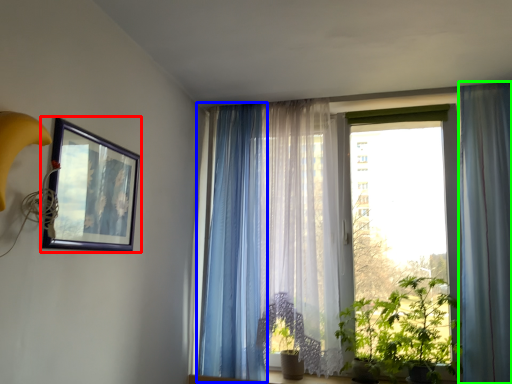
Question: Based on their relative distances, which object is farther from picture frame (highlighted by a red box)? Choose from curtain (highlighted by a blue box) and curtain (highlighted by a green box).

Choices:
 (A) curtain
 (B) curtain

Answer: (B)